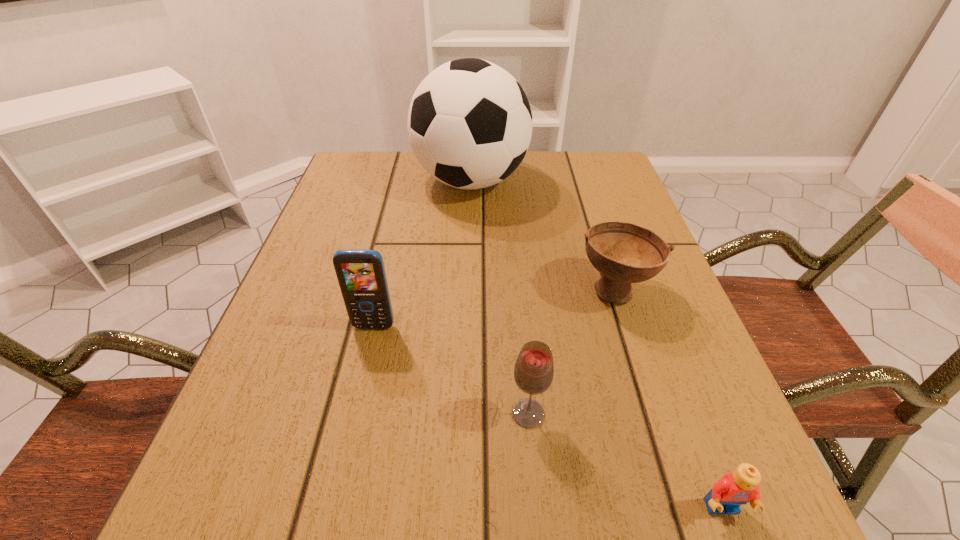
This screenshot has height=540, width=960. Identify the location of empty location between the third nearest object and the soup bowl. (494, 308).

The height and width of the screenshot is (540, 960). Find the location of `vacant region between the nearest object and the fourth nearest object`. vacant region between the nearest object and the fourth nearest object is located at coordinates (668, 399).

Image resolution: width=960 pixels, height=540 pixels. Find the location of `the closest object to the Lego`. the closest object to the Lego is located at coordinates (534, 369).

Identify which object is the closest to the Lego. Please provide its 2D coordinates. Your answer should be formatted as a tuple, i.e. [(x, y)], where the tuple contains the x and y coordinates of a point satisfying the conditions above.

[(534, 369)]

Identify the location of free location that satisfies the following two spatial constraints: 1. on the screen of the glass drink container; 2. on the left side of the second tallest object. The image size is (960, 540). (354, 414).

Identify the location of vacant point that satisfies the following two spatial constraints: 1. on the front side of the second farthest object; 2. on the right side of the farthest object. (468, 289).

This screenshot has width=960, height=540. Identify the location of vacant space that satisfies the following two spatial constraints: 1. on the back side of the glass drink container; 2. on the left side of the fourth nearest object. (517, 289).

Image resolution: width=960 pixels, height=540 pixels. What are the coordinates of `free space that satisfies the following two spatial constraints: 1. on the screen of the fourth farthest object; 2. on the right side of the fourth shortest object` in the screenshot? It's located at (x=354, y=414).

Image resolution: width=960 pixels, height=540 pixels. Identify the location of free location that satisfies the following two spatial constraints: 1. on the screen of the second nearest object; 2. on the right side of the fourth shortest object. (354, 414).